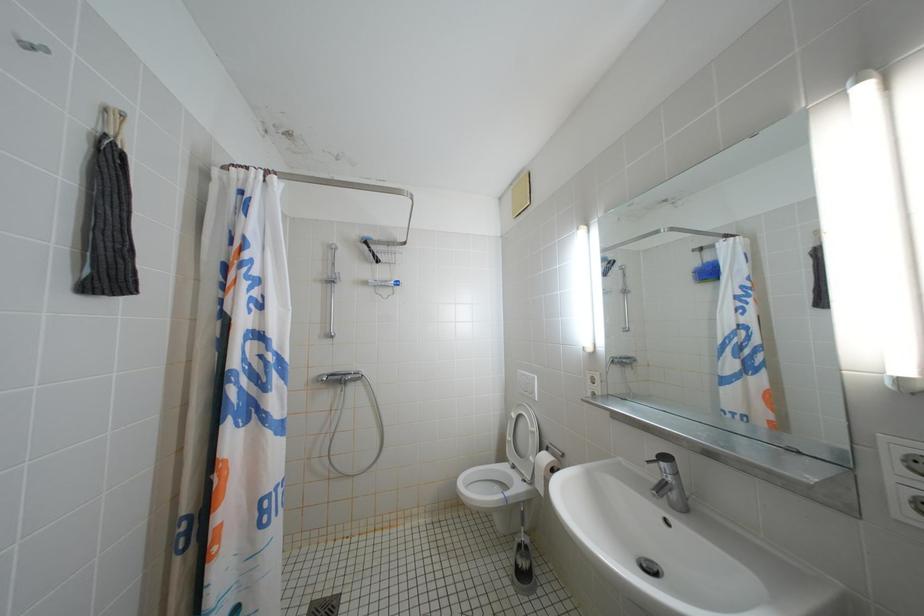
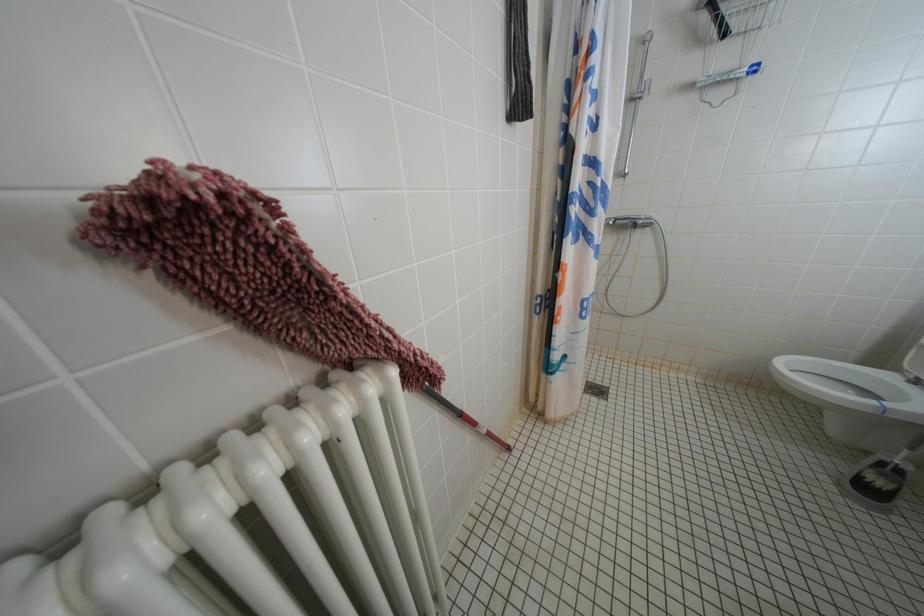
The first image is from the beginning of the video and the second image is from the end. How did the camera likely rotate when shooting the video?

The camera rotated toward left-down.